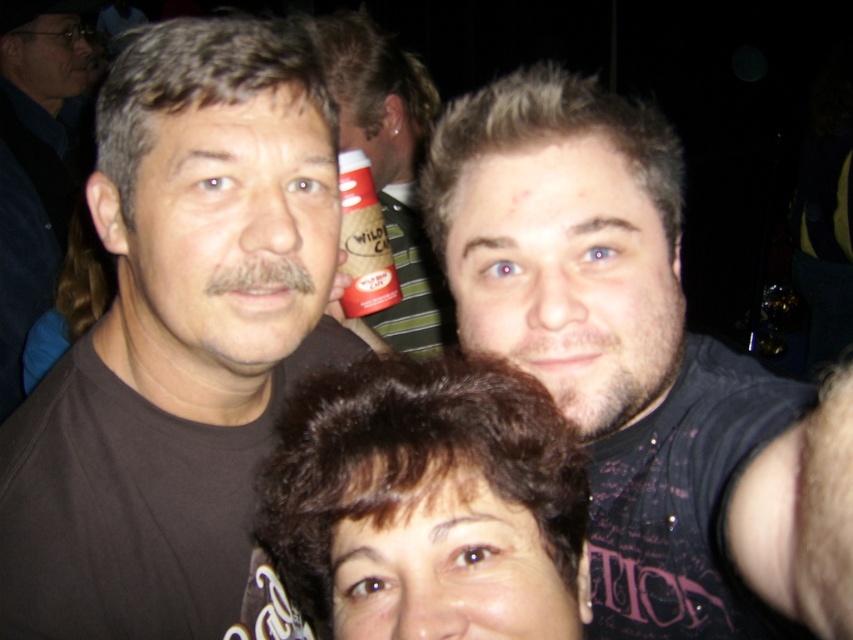
You are taking a photo of two points in the scene. The first point is at coordinate point (19, 45) and the second point is at coordinate point (347, 168). Which point is closer to the camera?

Point (19, 45) is further to the camera than point (347, 168), so the second point is closer to the camera.

You are at a party and want to know if the matte black shirt at center can fit into the red plastic cup at center. Based on their sizes, what would you conclude?

The matte black shirt at center has a smaller size compared to the red plastic cup at center, so it could potentially fit inside the cup.